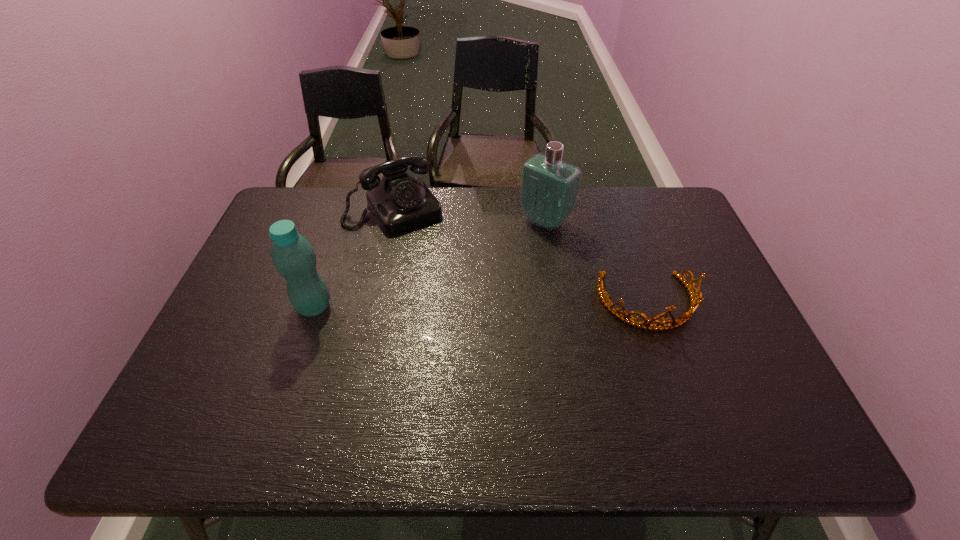
The height and width of the screenshot is (540, 960). I want to click on water bottle, so click(x=293, y=256).

The height and width of the screenshot is (540, 960). What are the coordinates of `tiara` in the screenshot? It's located at (695, 300).

Find the location of `the rightmost object`. the rightmost object is located at coordinates (695, 300).

Find the location of a particular element. This screenshot has height=540, width=960. the third object from left to right is located at coordinates pyautogui.click(x=549, y=188).

Identify the location of the second shortest object. The image size is (960, 540). (399, 202).

Find the location of a particular element. This screenshot has height=540, width=960. free space located at the front cap of the water bottle is located at coordinates (239, 306).

Identify the location of free space located 0.070m at the front cap of the water bottle. (269, 306).

At what (x,y) coordinates should I click in order to perform the action: click on vacant space situated at the front cap of the water bottle. Please return your answer as a coordinate pair (x, y). The image size is (960, 540). Looking at the image, I should click on (231, 306).

Locate an element on the screen. vacant area situated on the front-facing side of the tiara is located at coordinates (667, 359).

You are a GUI agent. You are given a task and a screenshot of the screen. Output one action in this format:
    pyautogui.click(x=<x>, y=<y>)
    Task: Click on the vacant space located 0.270m on the front label of the perfume
    
    Given the screenshot: What is the action you would take?
    pyautogui.click(x=476, y=282)